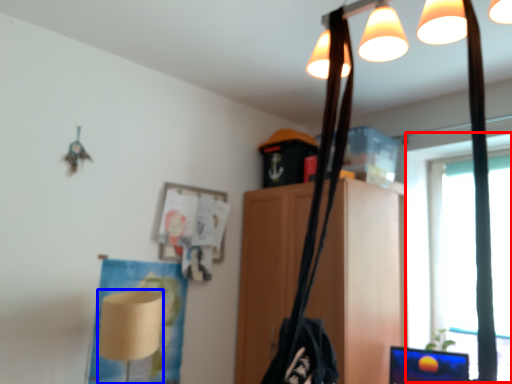
Question: Which object is closer to the camera taking this photo, window screen (highlighted by a red box) or lamp (highlighted by a blue box)?

Choices:
 (A) window screen
 (B) lamp

Answer: (B)